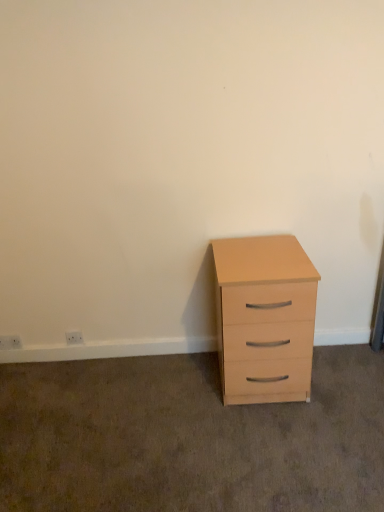
Question: From a real-world perspective, is white plastic electric outlet at lower left, marked as the 1th electric outlet in a left-to-right arrangement, physically located above or below light wood chest of drawers at right?

Choices:
 (A) above
 (B) below

Answer: (B)

Question: From the image's perspective, relative to light wood chest of drawers at right, is white plastic electric outlet at lower left, positioned as the second electric outlet in right-to-left order, above or below?

Choices:
 (A) above
 (B) below

Answer: (B)

Question: Based on their relative distances, which object is farther from the white plastic electric outlet at lower left, positioned as the second electric outlet in right-to-left order?

Choices:
 (A) white plastic electric outlet at lower left, the 1th electric outlet viewed from the right
 (B) light wood chest of drawers at right

Answer: (B)

Question: Which is nearer to the light wood chest of drawers at right?

Choices:
 (A) white plastic electric outlet at lower left, which is the 2th electric outlet from left to right
 (B) white plastic electric outlet at lower left, positioned as the second electric outlet in right-to-left order

Answer: (A)